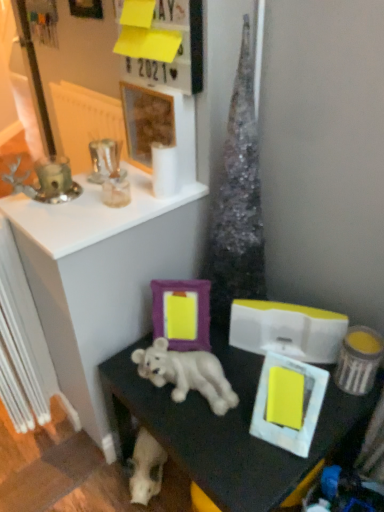
What are the coordinates of `vacant space in front of silver metallic candle holder at upper left` in the screenshot? It's located at (57, 222).